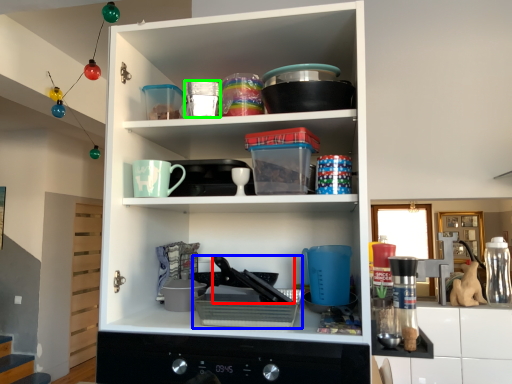
Question: Based on their relative distances, which object is nearer to appliance (highlighted by a red box)? Choose from appliance (highlighted by a blue box) and tableware (highlighted by a green box).

Choices:
 (A) appliance
 (B) tableware

Answer: (A)